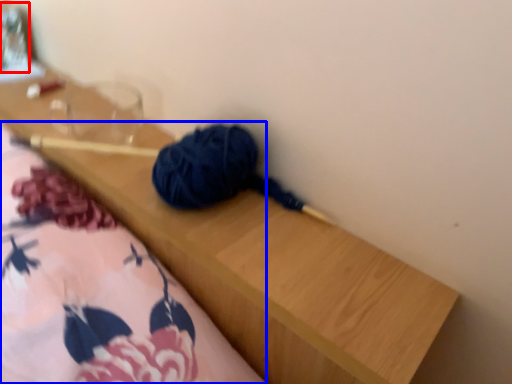
Question: Which object is further to the camera taking this photo, glass jar (highlighted by a red box) or blanket (highlighted by a blue box)?

Choices:
 (A) glass jar
 (B) blanket

Answer: (A)